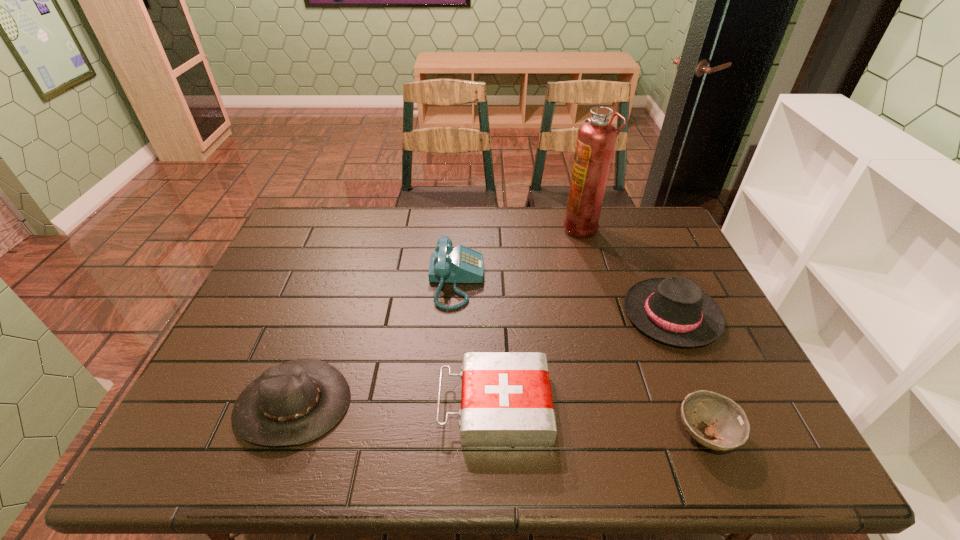
Find the location of a particular element. object that is at the left edge is located at coordinates (296, 402).

You are a GUI agent. You are given a task and a screenshot of the screen. Output one action in this format:
    pyautogui.click(x=<x>, y=<y>)
    Task: Click on the dress hat positioned at the right edge
    This screenshot has height=540, width=960.
    Given the screenshot: What is the action you would take?
    pyautogui.click(x=674, y=310)

Identify the location of bowl at the right edge. Image resolution: width=960 pixels, height=540 pixels. (727, 422).

This screenshot has height=540, width=960. I want to click on object positioned at the near left corner, so click(x=296, y=402).

Locate an element on the screen. The width and height of the screenshot is (960, 540). object that is positioned at the near right corner is located at coordinates (727, 422).

Where is `free spot at the far edge of the desktop`? free spot at the far edge of the desktop is located at coordinates click(x=538, y=228).

In order to click on vacant space at the near edge of the desktop in this screenshot , I will do `click(343, 430)`.

In order to click on vacant space at the right edge of the desktop in this screenshot , I will do `click(648, 260)`.

The image size is (960, 540). In the image, there is a desktop. Find the location of `blank space at the far right corner`. blank space at the far right corner is located at coordinates (621, 207).

Where is `blank space at the near right corner of the desktop`? Image resolution: width=960 pixels, height=540 pixels. blank space at the near right corner of the desktop is located at coordinates (771, 435).